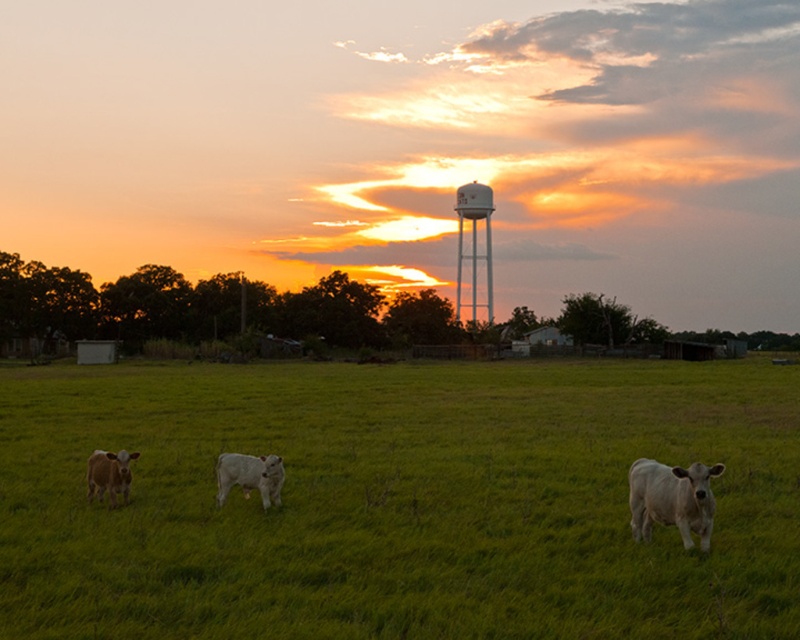
Question: Does green grass pasture at center have a greater width compared to white smooth cow at lower right?

Choices:
 (A) no
 (B) yes

Answer: (B)

Question: Which object appears farthest from the camera in this image?

Choices:
 (A) green grass pasture at center
 (B) brown smooth cow at lower left
 (C) white smooth cow at lower right

Answer: (B)

Question: Can you confirm if white smooth cow at lower right is bigger than brown smooth cow at lower left?

Choices:
 (A) yes
 (B) no

Answer: (B)

Question: Which point is farther to the camera?

Choices:
 (A) white smooth cow at center
 (B) white smooth cow at lower right

Answer: (A)

Question: From the image, what is the correct spatial relationship of green grass pasture at center in relation to white smooth cow at lower right?

Choices:
 (A) left
 (B) right

Answer: (A)

Question: Which is farther from the white smooth cow at center?

Choices:
 (A) white smooth cow at lower right
 (B) white matte water tower at upper center

Answer: (B)